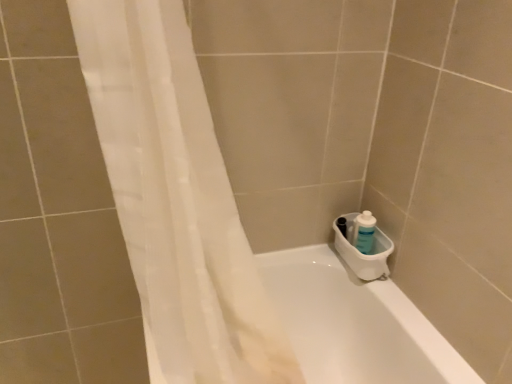
You are a GUI agent. You are given a task and a screenshot of the screen. Output one action in this format:
    pyautogui.click(x=<x>, y=<y>)
    Task: Click on the free space to the left of white plastic sink at lower right
    This screenshot has height=384, width=512.
    Given the screenshot: What is the action you would take?
    pyautogui.click(x=318, y=264)